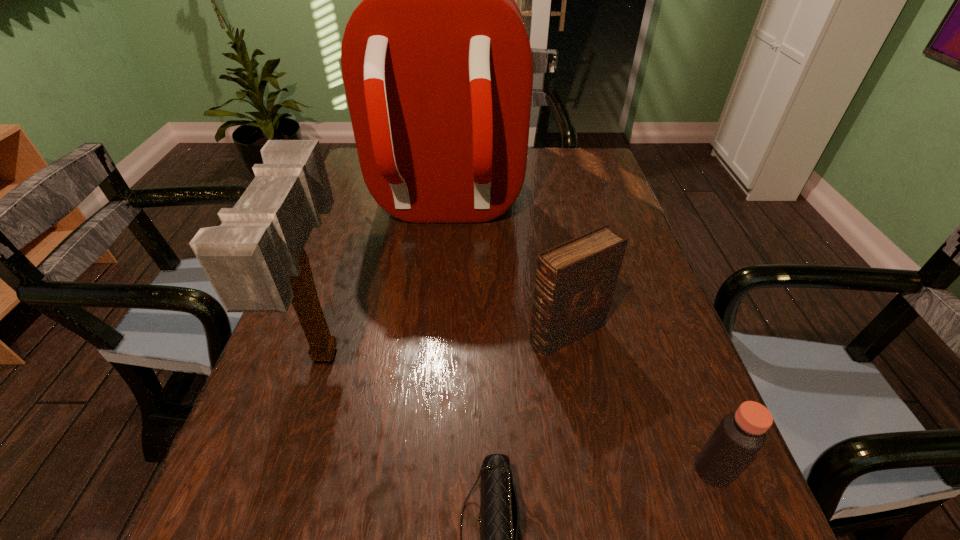
I want to click on free space between the mallet and the third shortest object, so click(446, 342).

Identify the location of vacant space that's between the Bible and the fourth shortest object. The image size is (960, 540). (446, 342).

I want to click on free spot between the second shortest object and the fourth shortest object, so click(x=519, y=411).

The width and height of the screenshot is (960, 540). Find the location of `vacant point located between the fourth shortest object and the Bible`. vacant point located between the fourth shortest object and the Bible is located at coordinates (446, 342).

Where is `vacant space in between the mallet and the fourth tallest object`? vacant space in between the mallet and the fourth tallest object is located at coordinates (519, 411).

Where is `the third closest object to the shortest object`? The image size is (960, 540). the third closest object to the shortest object is located at coordinates (740, 435).

Identify which object is located as the nearest to the third tallest object. Please provide its 2D coordinates. Your answer should be formatted as a tuple, i.e. [(x, y)], where the tuple contains the x and y coordinates of a point satisfying the conditions above.

[(437, 66)]

Identify the location of free location that satisfies the following two spatial constraints: 1. on the strap side of the tallest object; 2. on the left side of the rightmost object. (417, 470).

The width and height of the screenshot is (960, 540). I want to click on free region that satisfies the following two spatial constraints: 1. on the strap side of the Bible; 2. on the left side of the farthest object, so click(431, 333).